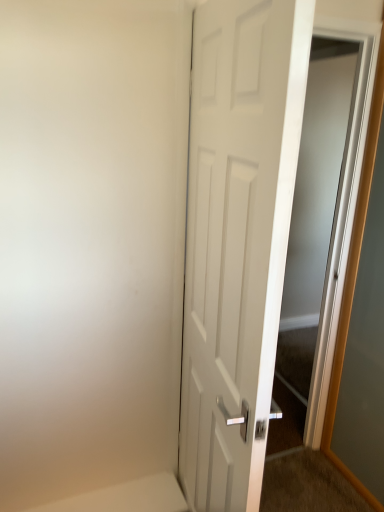
Question: Is white glossy elevator at right not inside white matte door at center?

Choices:
 (A) yes
 (B) no

Answer: (A)

Question: Does white glossy elevator at right have a greater height compared to white matte door at center?

Choices:
 (A) no
 (B) yes

Answer: (B)

Question: Does white glossy elevator at right appear on the left side of white matte door at center?

Choices:
 (A) yes
 (B) no

Answer: (B)

Question: From the image's perspective, is white glossy elevator at right over white matte door at center?

Choices:
 (A) yes
 (B) no

Answer: (A)

Question: Does white glossy elevator at right have a lesser height compared to white matte door at center?

Choices:
 (A) yes
 (B) no

Answer: (B)

Question: Is white glossy elevator at right positioned in front of white matte door at center?

Choices:
 (A) yes
 (B) no

Answer: (B)

Question: Does white matte door at center appear on the right side of white glossy elevator at right?

Choices:
 (A) yes
 (B) no

Answer: (B)

Question: Can you confirm if white matte door at center is bigger than white glossy elevator at right?

Choices:
 (A) yes
 (B) no

Answer: (A)

Question: Is white matte door at center behind white glossy elevator at right?

Choices:
 (A) yes
 (B) no

Answer: (B)

Question: From the image's perspective, is white matte door at center above white glossy elevator at right?

Choices:
 (A) yes
 (B) no

Answer: (B)

Question: Does white matte door at center have a greater height compared to white glossy elevator at right?

Choices:
 (A) no
 (B) yes

Answer: (A)

Question: Is white glossy elevator at right at the back of white matte door at center?

Choices:
 (A) yes
 (B) no

Answer: (B)

Question: Considering the positions of white matte door at center and white glossy elevator at right in the image, is white matte door at center bigger or smaller than white glossy elevator at right?

Choices:
 (A) small
 (B) big

Answer: (B)